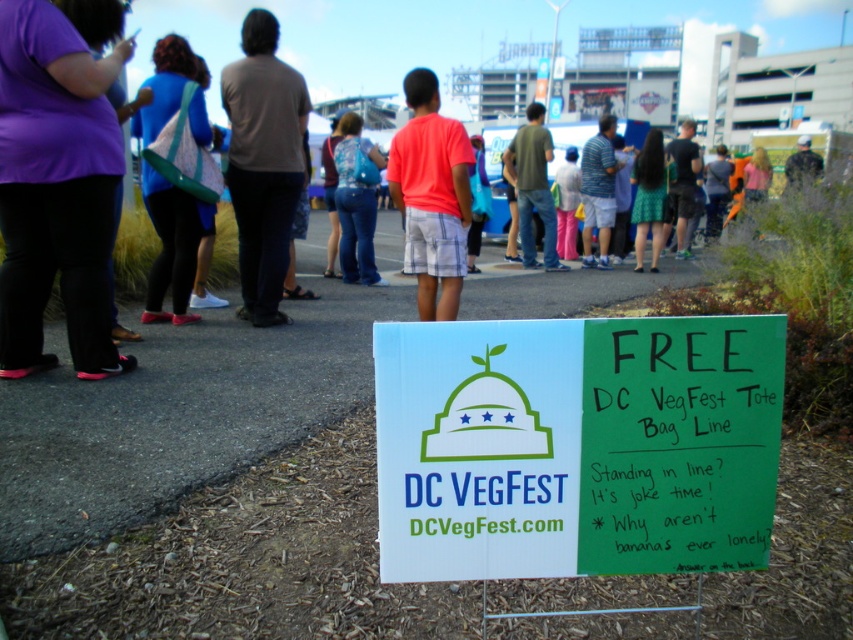
Between dark gray shirt at center and green cotton shirt at center, which one appears on the left side from the viewer's perspective?

dark gray shirt at center is more to the left.

The height and width of the screenshot is (640, 853). What do you see at coordinates (263, 163) in the screenshot? I see `dark gray shirt at center` at bounding box center [263, 163].

At what (x,y) coordinates should I click in order to perform the action: click on dark gray shirt at center. Please return your answer as a coordinate pair (x, y). The width and height of the screenshot is (853, 640). Looking at the image, I should click on (263, 163).

Who is higher up, dark gray shirt at center or blue denim jeans at center?

blue denim jeans at center is higher up.

Find the location of a particular element. This screenshot has width=853, height=640. dark gray shirt at center is located at coordinates coord(263,163).

Based on the photo, is matte black shirt at center taller than camouflage uniform at center?

Yes, matte black shirt at center is taller than camouflage uniform at center.

Is matte black shirt at center closer to camera compared to camouflage uniform at center?

That is True.

I want to click on matte black shirt at center, so click(x=346, y=38).